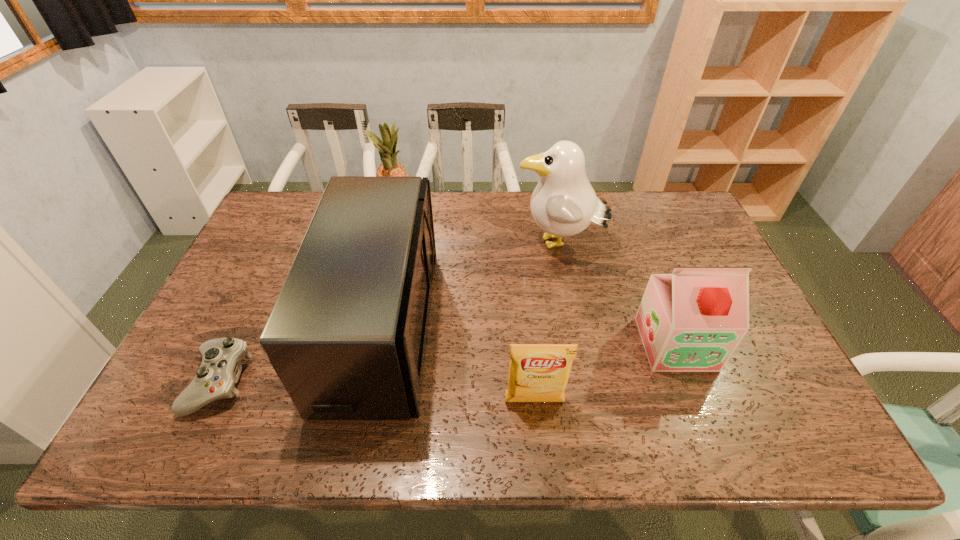
The height and width of the screenshot is (540, 960). Identify the location of gull. (563, 204).

Locate an element on the screen. pineapple is located at coordinates (387, 149).

What are the coordinates of `microwave_oven` in the screenshot? It's located at (347, 335).

The width and height of the screenshot is (960, 540). In order to click on the rightmost object in this screenshot , I will do `click(692, 320)`.

Identify the location of crisp (potato chip). (537, 372).

Where is `the shortest object`? the shortest object is located at coordinates (220, 368).

Identify the location of the leftmost object. This screenshot has height=540, width=960. (220, 368).

This screenshot has width=960, height=540. Find the location of `free space located on the beak of the gull`. free space located on the beak of the gull is located at coordinates (439, 244).

You are a GUI agent. You are given a task and a screenshot of the screen. Output one action in this format:
    pyautogui.click(x=<x>, y=<y>)
    Task: Click on the vacant area situated 0.310m on the beak of the gull
    
    Given the screenshot: What is the action you would take?
    pyautogui.click(x=417, y=244)

The height and width of the screenshot is (540, 960). In order to click on vacant area situated 0.380m on the beak of the gull in this screenshot , I will do `click(396, 244)`.